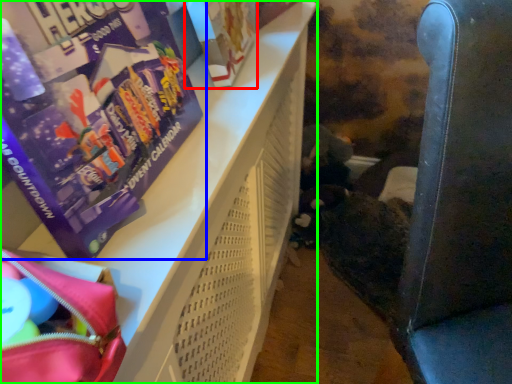
Question: Which is farther away from paperback book (highlighted by a red box)? book (highlighted by a blue box) or furniture (highlighted by a green box)?

Choices:
 (A) book
 (B) furniture

Answer: (A)